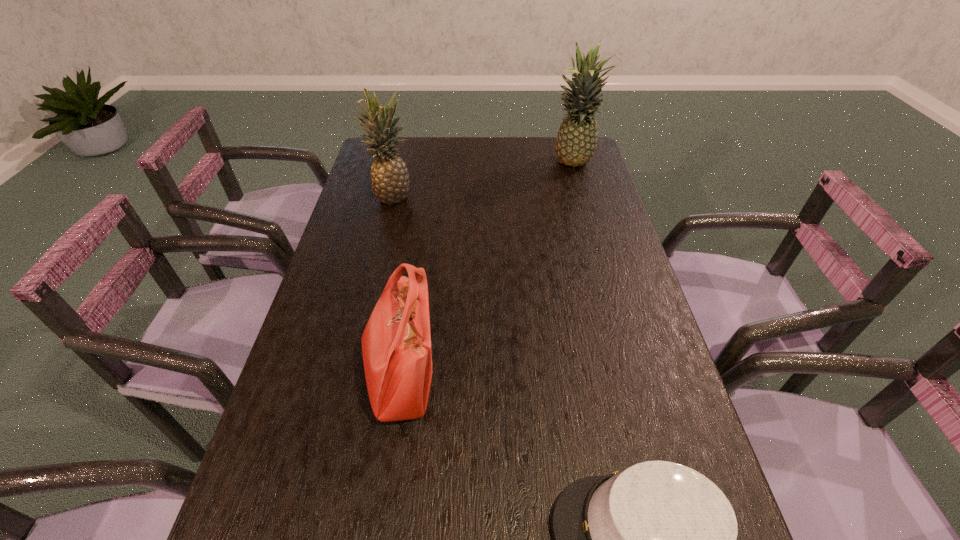
Locate an element on the screen. This screenshot has width=960, height=540. the taller pineapple is located at coordinates (576, 142).

In order to click on the farthest object in this screenshot , I will do `click(576, 142)`.

You are a GUI agent. You are given a task and a screenshot of the screen. Output one action in this format:
    pyautogui.click(x=<x>, y=<y>)
    Task: Click on the nearer pineapple
    The height and width of the screenshot is (540, 960).
    Given the screenshot: What is the action you would take?
    (390, 180)

Where is `the left pineapple`? The width and height of the screenshot is (960, 540). the left pineapple is located at coordinates (390, 180).

This screenshot has height=540, width=960. I want to click on the third farthest object, so click(x=396, y=343).

The image size is (960, 540). In order to click on free space located 0.150m on the front of the farther pineapple in this screenshot , I will do 583,203.

I want to click on free space located 0.340m on the front of the shorter pineapple, so click(370, 286).

In order to click on vacant region located 0.120m on the front-facing side of the second nearest object in this screenshot , I will do `click(494, 378)`.

What are the coordinates of `object present at the far edge` in the screenshot? It's located at (576, 142).

Image resolution: width=960 pixels, height=540 pixels. What are the coordinates of `pineapple present at the left edge` in the screenshot? It's located at (390, 180).